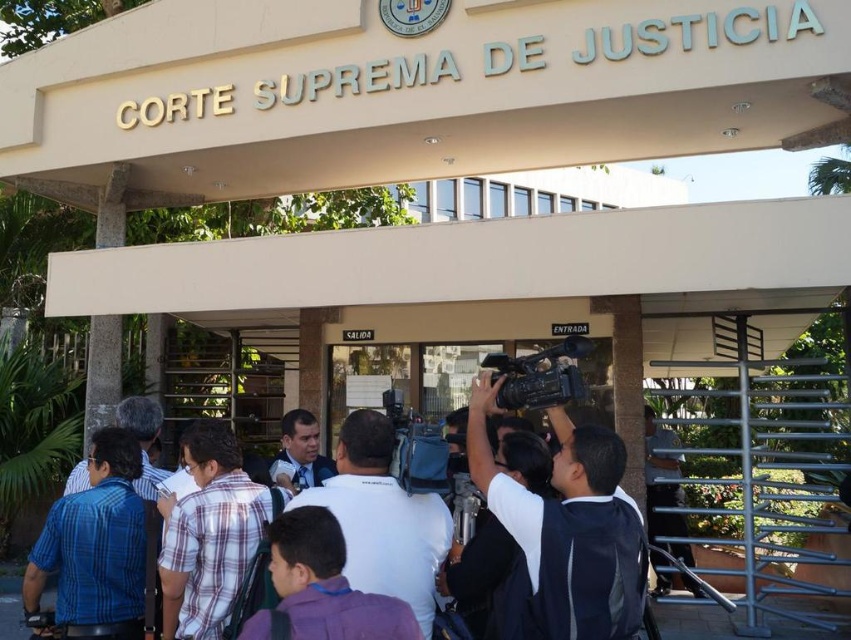
Question: Among these objects, which one is farthest from the camera?

Choices:
 (A) white shirt at center
 (B) black plastic video camera at center

Answer: (B)

Question: Which object appears farthest from the camera in this image?

Choices:
 (A) black plastic video camera at center
 (B) white shirt at center

Answer: (A)

Question: Can you confirm if white shirt at center is positioned to the left of black plastic video camera at center?

Choices:
 (A) no
 (B) yes

Answer: (B)

Question: Does white shirt at center appear over black plastic video camera at center?

Choices:
 (A) no
 (B) yes

Answer: (A)

Question: Which object appears farthest from the camera in this image?

Choices:
 (A) black plastic video camera at center
 (B) white shirt at center

Answer: (A)

Question: Is white shirt at center smaller than black plastic video camera at center?

Choices:
 (A) yes
 (B) no

Answer: (B)